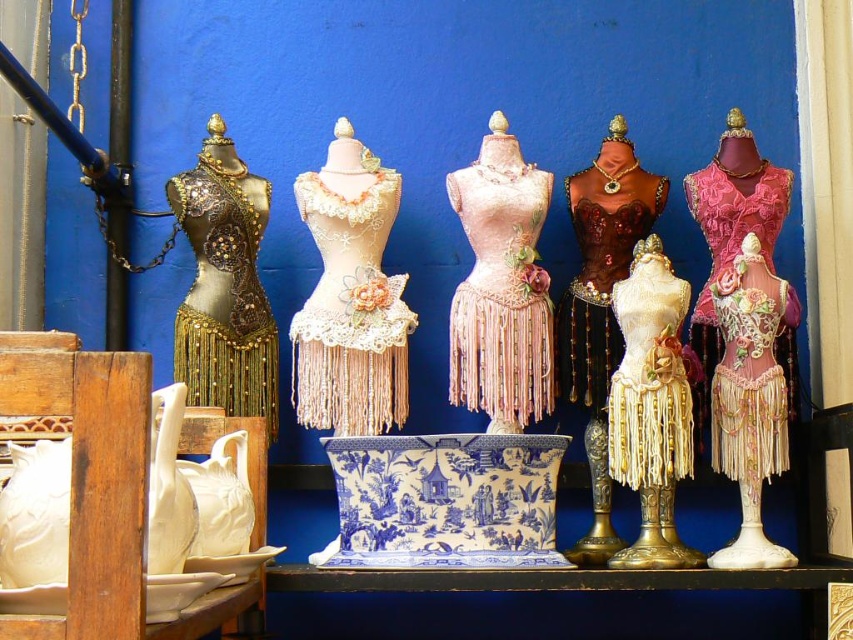
Question: Can you confirm if blue and white porcelain vase at center is positioned to the left of gold beaded dress at left?

Choices:
 (A) yes
 (B) no

Answer: (B)

Question: Estimate the real-world distances between objects in this image. Which object is closer to the gold fringed dress form at center?

Choices:
 (A) pink lace dress at right
 (B) blue and white porcelain vase at center

Answer: (A)

Question: Among these objects, which one is nearest to the camera?

Choices:
 (A) pink lace dress at center
 (B) pink lace dress at right

Answer: (A)

Question: Which object is farther from the camera taking this photo?

Choices:
 (A) blue and white porcelain vase at center
 (B) pink lace dress at center
 (C) gold fringed dress form at center

Answer: (B)

Question: Is pink lace dress at center smaller than lace fabric dress at center?

Choices:
 (A) yes
 (B) no

Answer: (B)

Question: Can you confirm if lace fabric dress at center is positioned above pink lace dress at right?

Choices:
 (A) yes
 (B) no

Answer: (A)